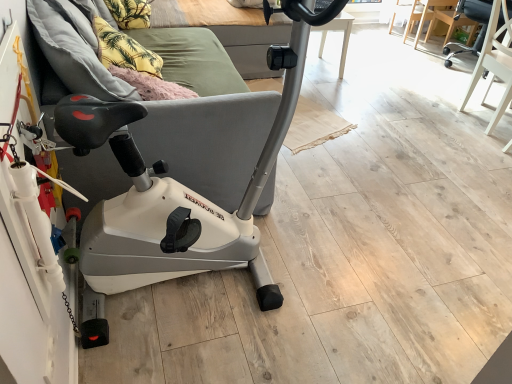
Locate an element on the screen. The height and width of the screenshot is (384, 512). vacant space in front of black leather swivel chair at upper right, which is the 2th swivel chair in back-to-front order is located at coordinates (485, 147).